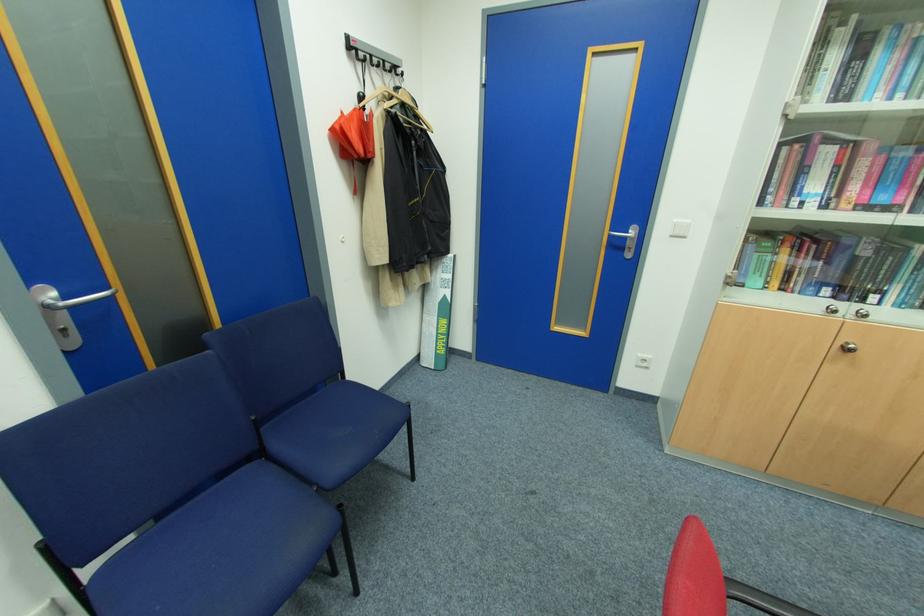
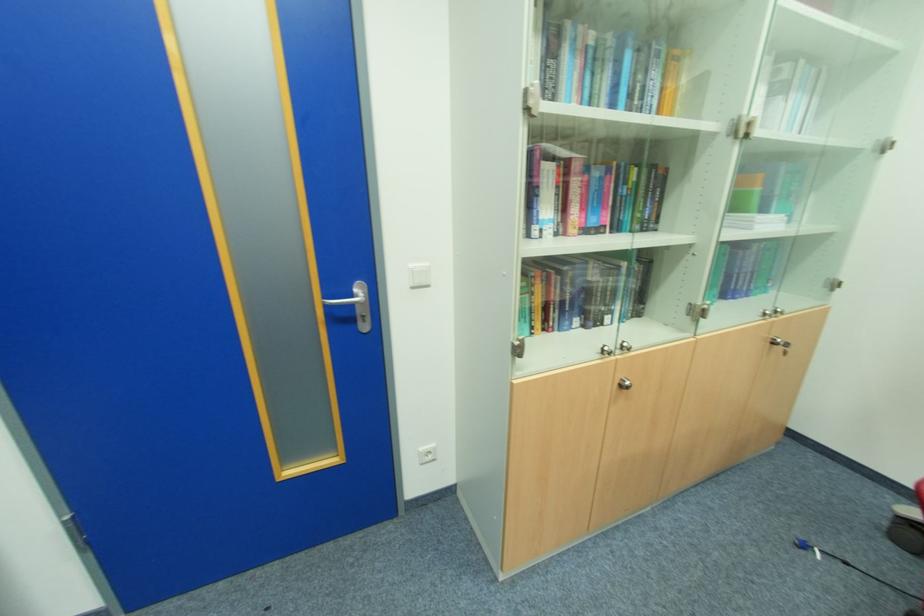
Question: The camera is either moving clockwise (left) or counter-clockwise (right) around the object. The first image is from the beginning of the video and the second image is from the end. Is the camera moving left or right when shooting the video?

Choices:
 (A) Left
 (B) Right

Answer: (A)